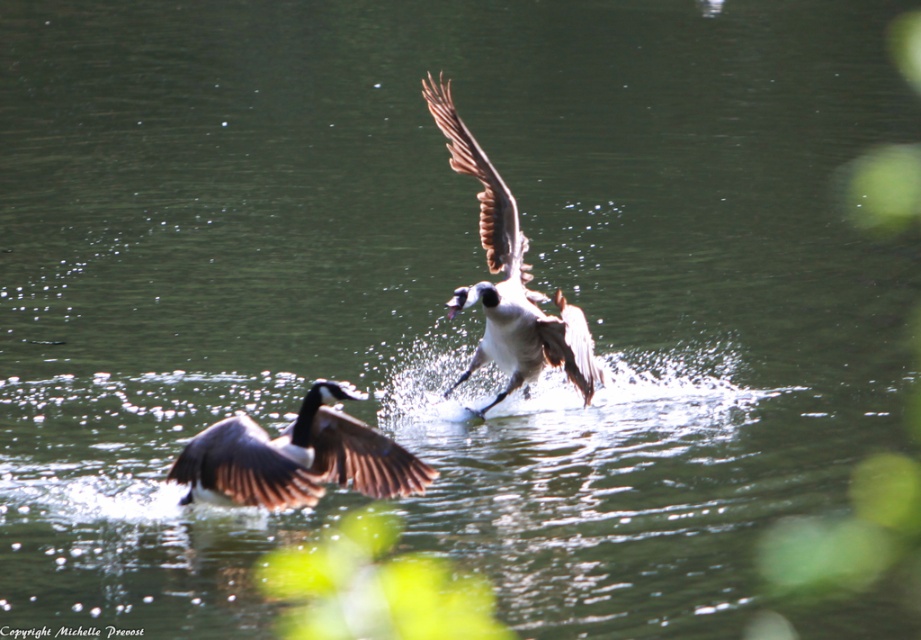
Question: Which point is closer to the camera?

Choices:
 (A) white feathered goose at center
 (B) brown feathered goose at center
 (C) brown feathered wing at upper center

Answer: (B)

Question: Does brown feathered goose at center come in front of white feathered goose at center?

Choices:
 (A) yes
 (B) no

Answer: (A)

Question: Which object is the farthest from the white feathered goose at center?

Choices:
 (A) brown feathered wing at upper center
 (B) brown feathered goose at center

Answer: (B)

Question: Is white feathered goose at center positioned at the back of brown feathered wing at upper center?

Choices:
 (A) no
 (B) yes

Answer: (A)

Question: Is brown feathered goose at center further to camera compared to white feathered goose at center?

Choices:
 (A) yes
 (B) no

Answer: (B)

Question: Estimate the real-world distances between objects in this image. Which object is closer to the white feathered goose at center?

Choices:
 (A) brown feathered goose at center
 (B) brown feathered wing at upper center

Answer: (B)